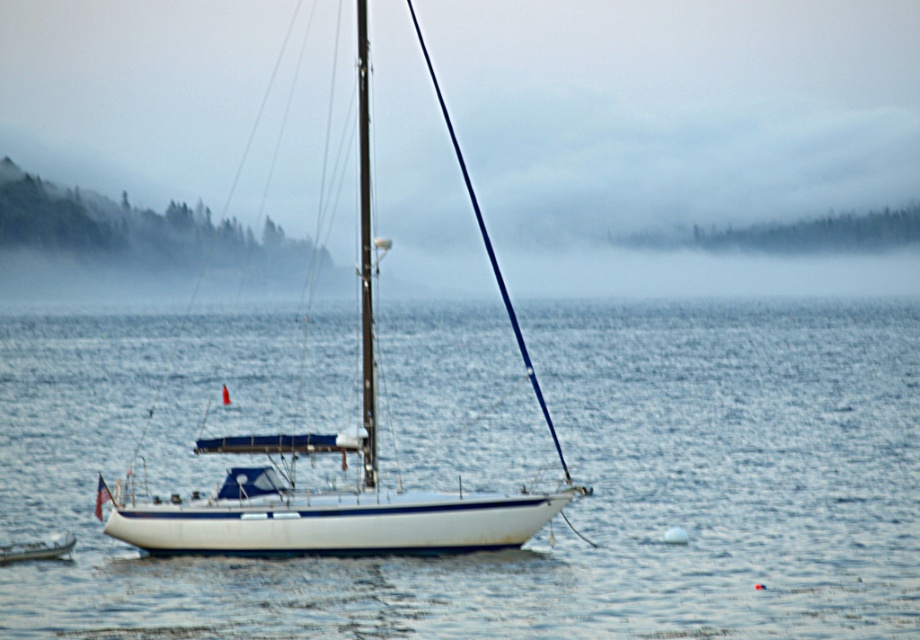
You are standing on the deck of the sailboat and want to locate two points marked on the boat. The first point is at coordinate point (870, 548) and the second is at point (75, 536). Which point is closer to you?

Point (870, 548) is closer to the camera than point (75, 536).

You are a marine biologist measuring the distance between two objects in the image. You need to determine if the distance between the white smooth water at center and the white glossy sailboat at center is more than 100 feet. What is your conclusion?

The distance between the white smooth water at center and the white glossy sailboat at center is 123.82 feet, which is more than 100 feet.

You are a sailor trying to navigate from the white glossy sailboat at center to the buoy. According to the scene, which direction should you move relative to the white smooth water at center?

The white smooth water at center is located below the white glossy sailboat at center, so to reach the buoy, you should move downward from the white glossy sailboat at center towards the white smooth water at center where the rope is attached to the buoy.